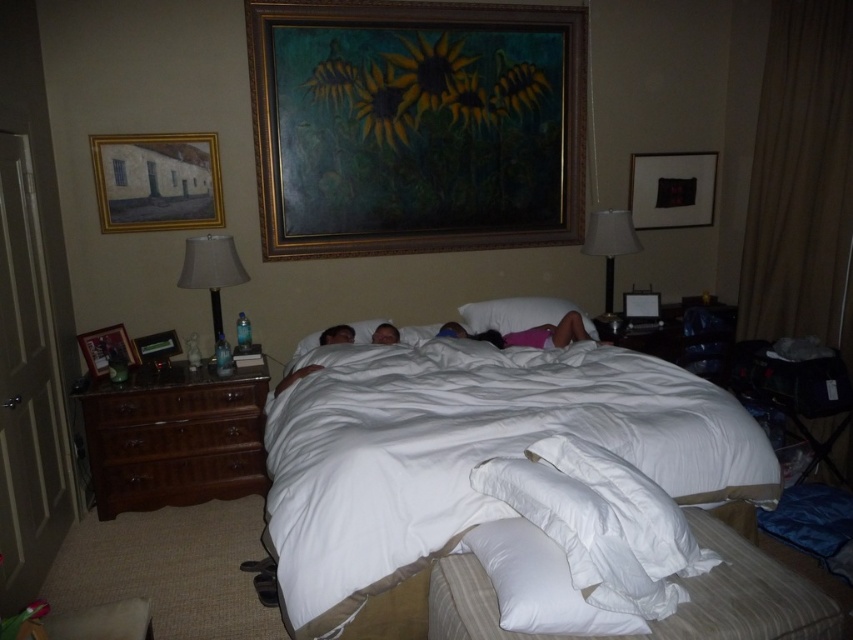
You are standing in the bedroom and want to hang a new poster on the wall behind the wooden framed painting at upper left and the matte black picture frame at center. Which object should you move first to make space?

You should move the wooden framed painting at upper left first because it is in front of the matte black picture frame at center, so moving it would allow access to the wall space behind both.

You are a guest in this bedroom and need to make sure your luggage fits under the bed. The luggage is 1.2 meters tall. Can you determine if there is enough vertical space between the white soft bedcover at center and the white soft pillow at lower center for the luggage?

The white soft bedcover at center is much taller than the white soft pillow at lower center. Since the luggage is 1.2 meters tall, there should be sufficient vertical space between them to accommodate it.